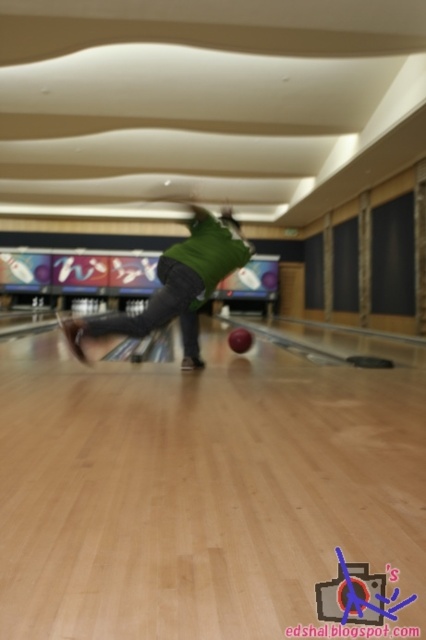
You are a photographer standing at the end of the bowling lane. You want to take a photo that includes both the green matte shirt at center and the shiny red bowling ball at center. What is the minimum distance you need to move backward to ensure both objects are in frame?

The green matte shirt at center is 5.23 feet from the shiny red bowling ball at center. To capture both in the frame, you need to move back at least 5.23 feet to ensure both are within the camera view.

You are a spectator at the bowling alley and notice the green matte shirt at center and the shiny red bowling ball at center. Which object is positioned higher in the image?

The green matte shirt at center is located above the shiny red bowling ball at center, so it is positioned higher in the image.

You are a spectator at the bowling alley and notice the green matte shirt at center and the shiny red bowling ball at center. Which object is positioned more to the right?

The shiny red bowling ball at center is positioned more to the right than the green matte shirt at center.